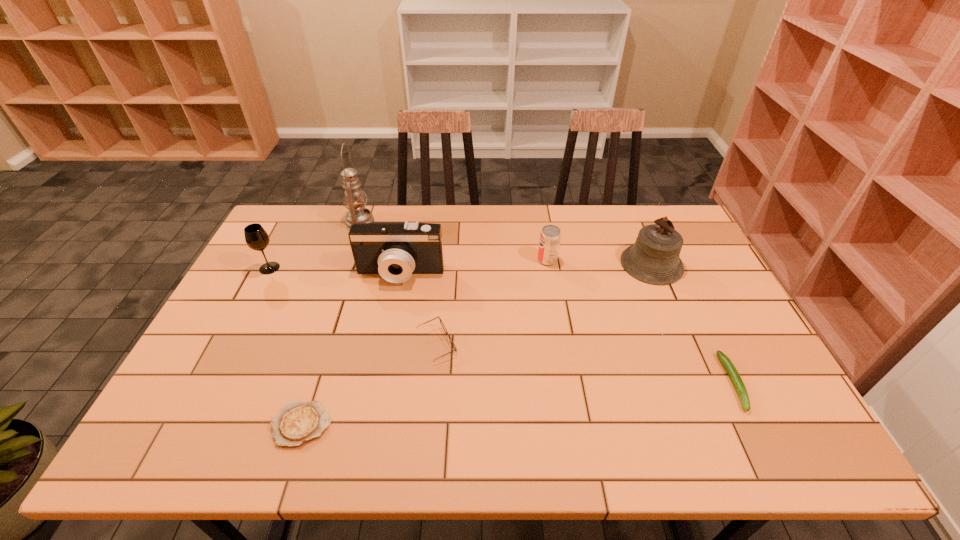
Locate an element on the screen. free space between the sixth object from left to right and the shortest object is located at coordinates (424, 342).

Image resolution: width=960 pixels, height=540 pixels. I want to click on free point between the soda and the bell, so click(599, 262).

Where is `vacant region between the spectacles and the quiche`? The height and width of the screenshot is (540, 960). vacant region between the spectacles and the quiche is located at coordinates (369, 384).

Identify the location of free spot between the leftmost object and the camcorder. This screenshot has height=540, width=960. (335, 271).

Where is `vacant area between the spectacles and the soda`? This screenshot has height=540, width=960. vacant area between the spectacles and the soda is located at coordinates (492, 302).

At what (x,y) coordinates should I click in order to perform the action: click on free space between the spectacles and the camcorder. Please return your answer as a coordinate pair (x, y). Looking at the image, I should click on (419, 309).

You are a GUI agent. You are given a task and a screenshot of the screen. Output one action in this format:
    pyautogui.click(x=<x>, y=<y>)
    Task: Click on the free space between the shortest object and the spectacles
    This screenshot has height=540, width=960.
    Given the screenshot: What is the action you would take?
    pyautogui.click(x=369, y=384)

At what (x,y) coordinates should I click in order to perform the action: click on free space between the quiche and the spectacles. Please return your answer as a coordinate pair (x, y). The image size is (960, 540). Looking at the image, I should click on (369, 384).

Identify the location of empty space that is in between the wineglass and the camcorder. (335, 271).

Choose which object is the second nearest neighbor to the wineglass. Please provide its 2D coordinates. Your answer should be formatted as a tuple, i.e. [(x, y)], where the tuple contains the x and y coordinates of a point satisfying the conditions above.

[(395, 250)]